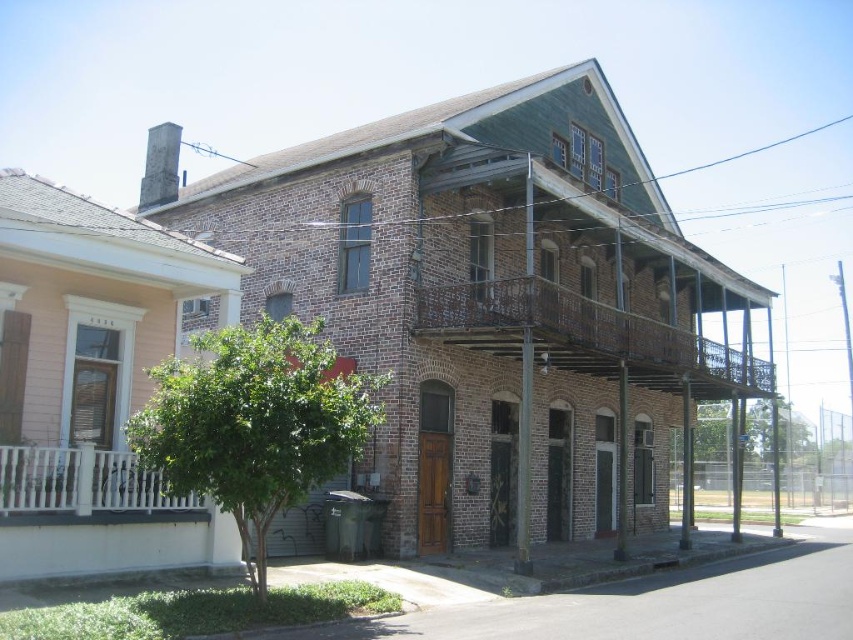
How far apart are rusty metal balcony at center and white painted wood at left?

A distance of 36.95 feet exists between rusty metal balcony at center and white painted wood at left.

You are a GUI agent. You are given a task and a screenshot of the screen. Output one action in this format:
    pyautogui.click(x=<x>, y=<y>)
    Task: Click on the rusty metal balcony at center
    
    Given the screenshot: What is the action you would take?
    pyautogui.click(x=585, y=337)

You are a GUI agent. You are given a task and a screenshot of the screen. Output one action in this format:
    pyautogui.click(x=<x>, y=<y>)
    Task: Click on the rusty metal balcony at center
    The image size is (853, 640).
    Given the screenshot: What is the action you would take?
    pyautogui.click(x=585, y=337)